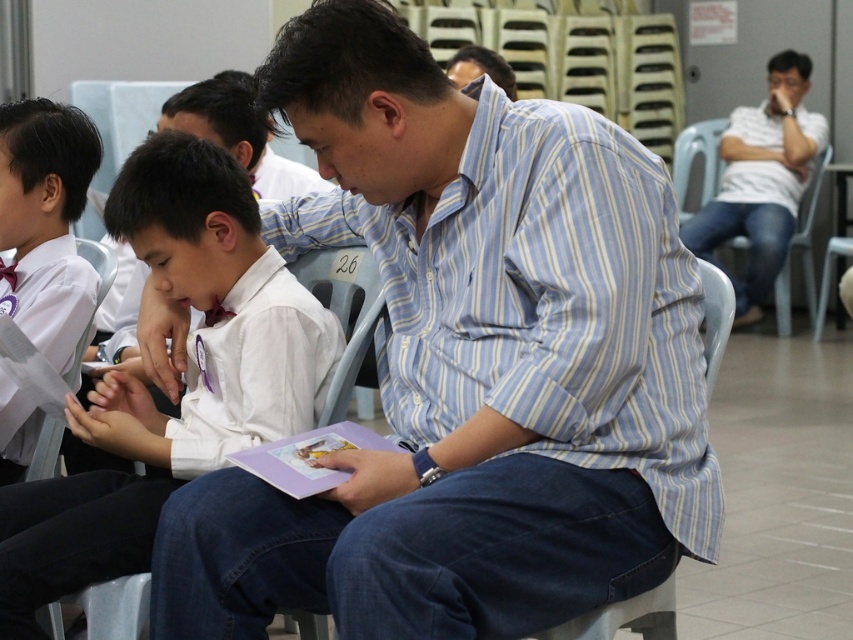
Question: Which of these objects is positioned farthest from the white shirt at center?

Choices:
 (A) white cotton shirt at upper right
 (B) blue striped shirt at center

Answer: (A)

Question: Is blue striped shirt at center positioned in front of white shirt at center?

Choices:
 (A) no
 (B) yes

Answer: (B)

Question: Is white uniform shirt at left to the left of white cotton shirt at upper right from the viewer's perspective?

Choices:
 (A) yes
 (B) no

Answer: (A)

Question: Which of the following is the closest to the observer?

Choices:
 (A) (1, 452)
 (B) (759, 113)
 (C) (531, 538)
 (D) (67, 499)

Answer: (C)

Question: Considering the relative positions of blue striped shirt at center and white shirt at center in the image provided, where is blue striped shirt at center located with respect to white shirt at center?

Choices:
 (A) right
 (B) left

Answer: (A)

Question: Which is farther from the white uniform shirt at left?

Choices:
 (A) blue striped shirt at center
 (B) white shirt at center
 (C) white cotton shirt at upper right

Answer: (C)